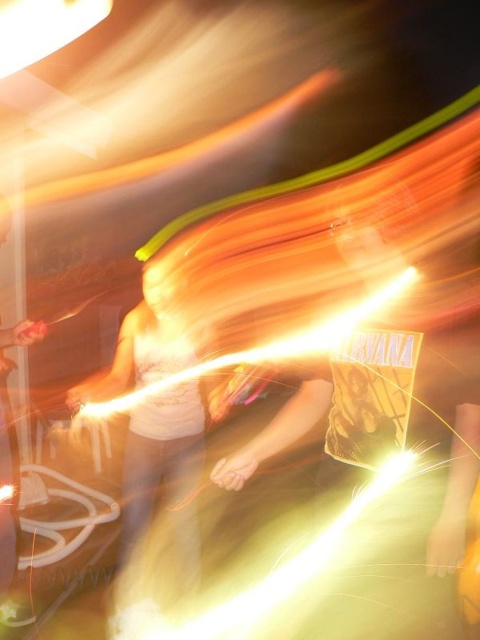
Question: Can you confirm if white cotton shirt at center is positioned below metallic silver fork at left?

Choices:
 (A) yes
 (B) no

Answer: (B)

Question: Which point is farther to the camera?

Choices:
 (A) white cotton shirt at center
 (B) metallic silver fork at left

Answer: (B)

Question: Which point is closer to the camera?

Choices:
 (A) white cotton shirt at center
 (B) metallic silver fork at left

Answer: (A)

Question: Observing the image, what is the correct spatial positioning of white cotton shirt at center in reference to metallic silver fork at left?

Choices:
 (A) left
 (B) right

Answer: (B)

Question: Which object appears farthest from the camera in this image?

Choices:
 (A) white cotton shirt at center
 (B) metallic silver fork at left

Answer: (B)

Question: Is white cotton shirt at center to the left of metallic silver fork at left from the viewer's perspective?

Choices:
 (A) yes
 (B) no

Answer: (B)